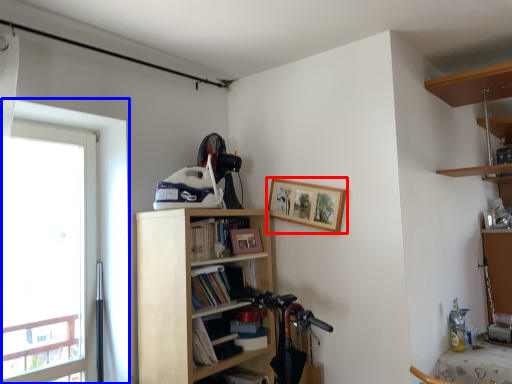
Question: Which point is closer to the camera, picture frame (highlighted by a red box) or window (highlighted by a blue box)?

Choices:
 (A) picture frame
 (B) window

Answer: (B)